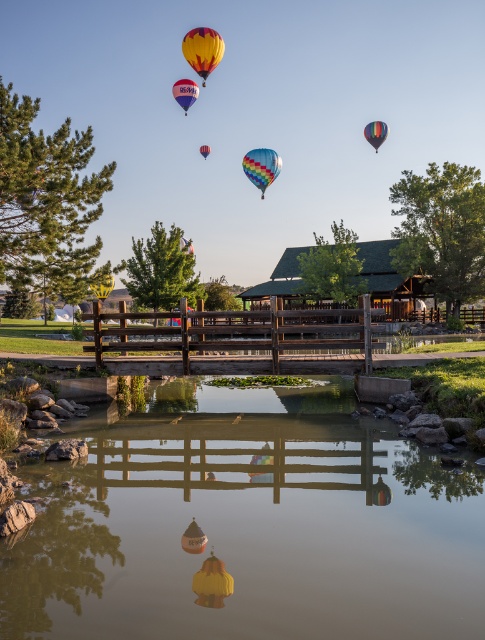
You are standing by the pond and see the rainbow striped balloon at center and the multicolored fabric hot air balloon at upper center. Which balloon is located to the left of the other?

The rainbow striped balloon at center is positioned on the right side of multicolored fabric hot air balloon at upper center, so the multicolored fabric hot air balloon at upper center is to the left of the rainbow striped balloon at center.

You are a photographer trying to capture a clear shot of the rainbow striped balloon at center and the multicolored fabric hot air balloon at upper center. If you want to ensure both balloons are fully visible in your photo, which balloon should you focus on first to avoid any part of it being cut off?

You should focus on the rainbow striped balloon at center first because it might be wider than the multicolored fabric hot air balloon at upper center, so ensuring it fits entirely in the frame will help accommodate the other balloon as well.

You are standing by the pond and see the rainbow striped balloon at center and the yellow and red striped hot air balloon at upper center. Which balloon is located to the right of the other?

The rainbow striped balloon at center is positioned on the right side of yellow and red striped hot air balloon at upper center.